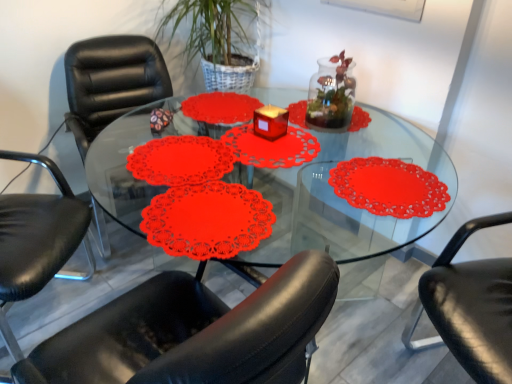
The image size is (512, 384). Find the location of `vacant space in front of matte red candle at center`. vacant space in front of matte red candle at center is located at coordinates (266, 153).